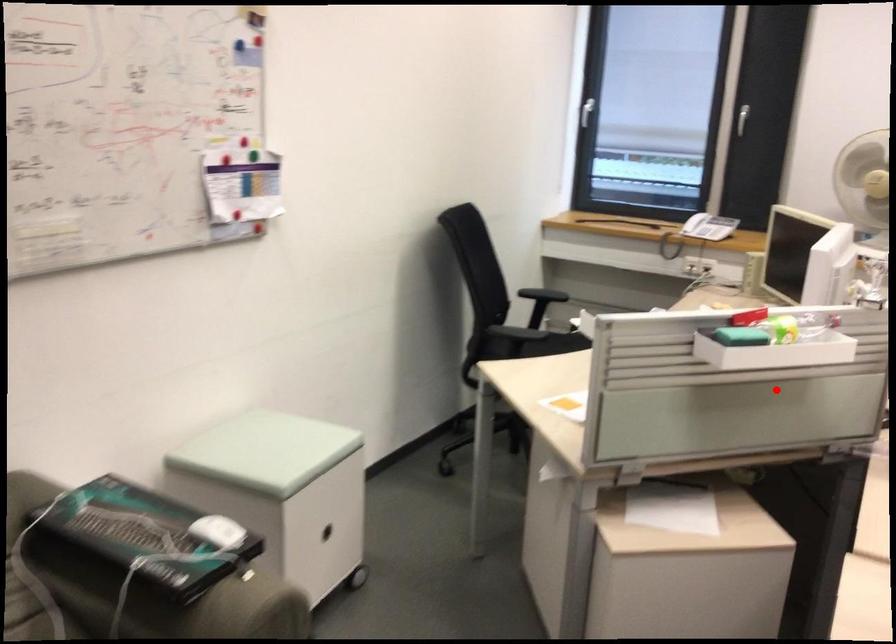
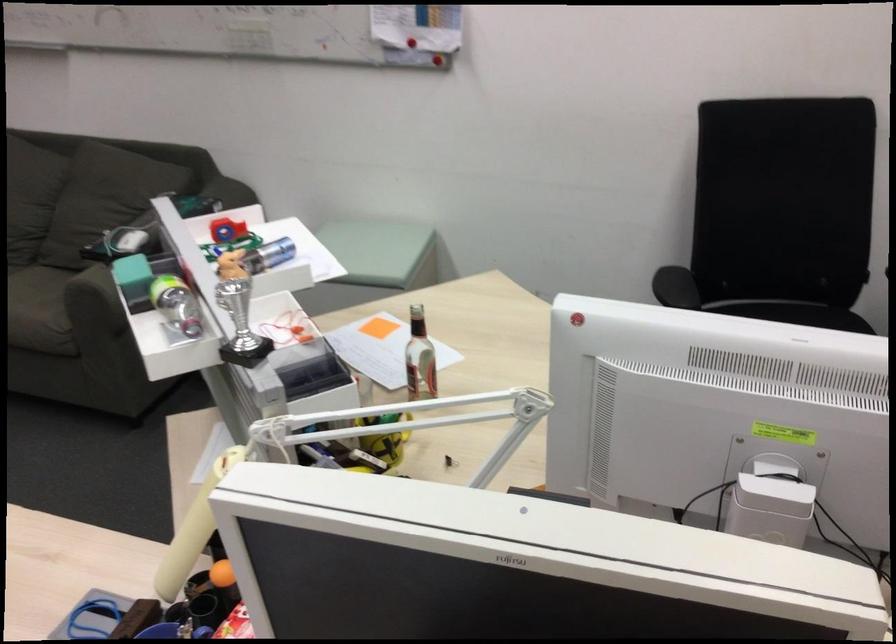
Question: A red point is marked in image1. In image2, is the corresponding 3D point closer to the camera or farther? Reply with the corresponding letter.

Choices:
 (A) The corresponding 3D point is closer.
 (B) The corresponding 3D point is farther.

Answer: (A)